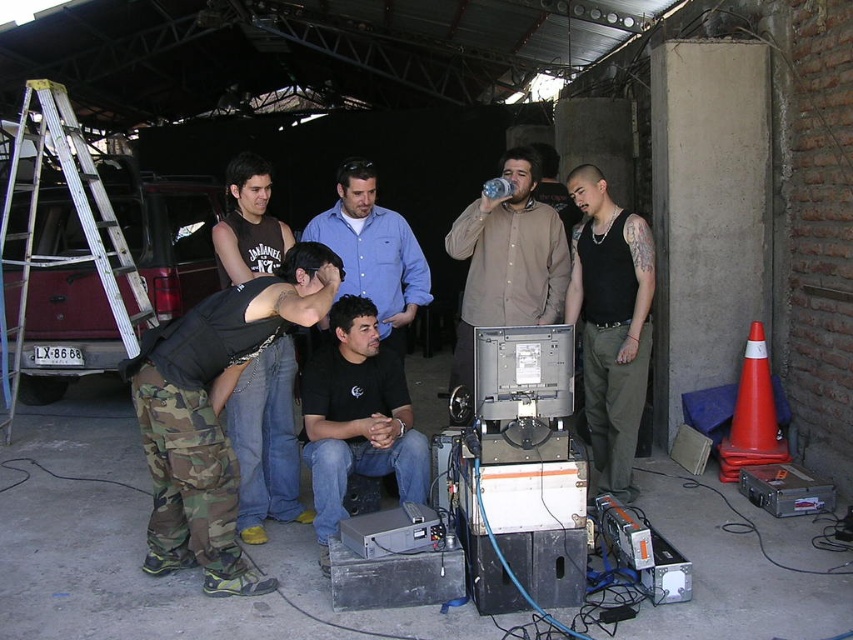
You are standing in the garage and need to retrieve an item from the top of the silver metallic ladder at left. However, there is a blue shirt at center in the way. Can you safely move the ladder to access the item?

The silver metallic ladder at left is positioned over blue shirt at center, so you cannot safely move the ladder without first moving the blue shirt at center out of the way.

You are standing in the garage and need to reach a tool placed on the top shelf, which is behind the silver metallic ladder at left and the brown matte shirt at center. Which object is closer to the shelf so you can move it first?

The silver metallic ladder at left is positioned on the left side of brown matte shirt at center, so the brown matte shirt at center is closer to the shelf and should be moved first to access the tool.

You are a delivery person who needs to place a package that requires a 2.5 meter clearance between the silver metallic ladder at left and the blue shirt at center. Can you fit the package between them?

The distance between the silver metallic ladder at left and the blue shirt at center is 2.20 meters, which is less than the required 2.5 meters. Therefore, the package cannot be placed between them with the necessary clearance.